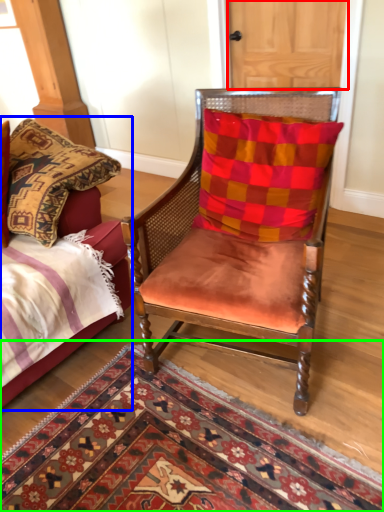
Question: Which object is the closest to the door (highlighted by a red box)? Choose among these: bed (highlighted by a blue box) or mat (highlighted by a green box).

Choices:
 (A) bed
 (B) mat

Answer: (A)